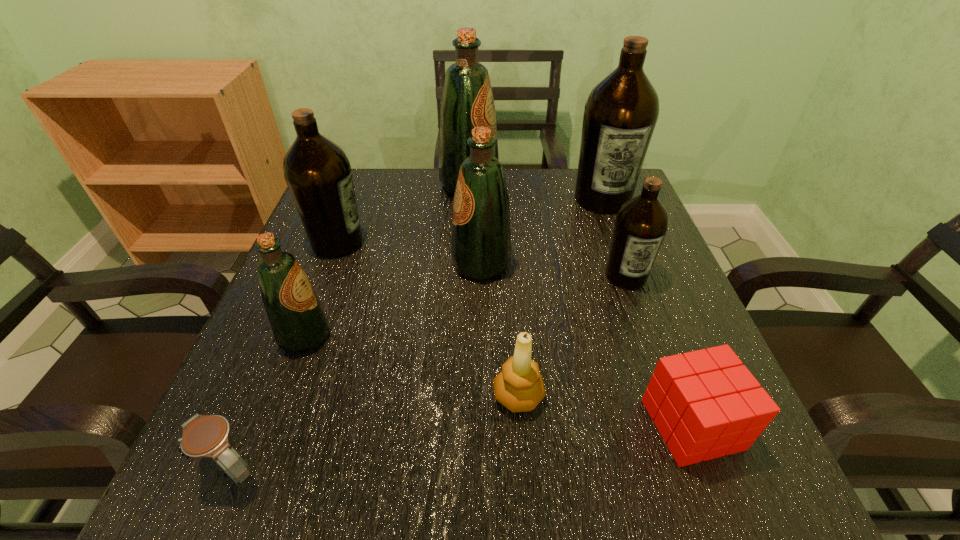
The height and width of the screenshot is (540, 960). What are the coordinates of `the farthest brown olive oil` in the screenshot? It's located at (620, 115).

This screenshot has width=960, height=540. Identify the location of the biggest green olive oil. (467, 101).

This screenshot has width=960, height=540. I want to click on the second smallest green olive oil, so [x=481, y=240].

The image size is (960, 540). Find the location of `the leftmost brown olive oil`. the leftmost brown olive oil is located at coordinates (317, 171).

This screenshot has height=540, width=960. Identify the location of the second smallest brown olive oil. (317, 171).

Find the location of a particular element. This screenshot has width=960, height=540. the nearest olive oil is located at coordinates [x=298, y=321].

I want to click on the smallest green olive oil, so click(298, 321).

Where is `the nearest brown olive oil`? the nearest brown olive oil is located at coordinates (641, 223).

You are a GUI agent. You are given a task and a screenshot of the screen. Output one action in this format:
    pyautogui.click(x=<x>, y=<y>)
    Task: Click on the candle_holder
    This screenshot has height=540, width=960.
    Given the screenshot: What is the action you would take?
    pyautogui.click(x=519, y=387)

This screenshot has width=960, height=540. I want to click on red cube, so click(705, 404).